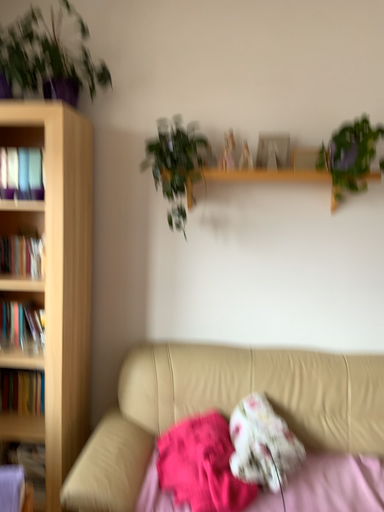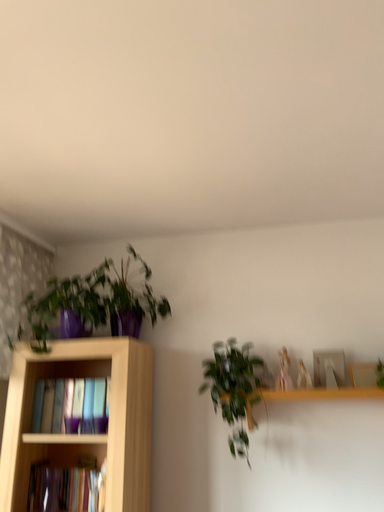
Question: How did the camera likely rotate when shooting the video?

Choices:
 (A) rotated left
 (B) rotated right

Answer: (A)